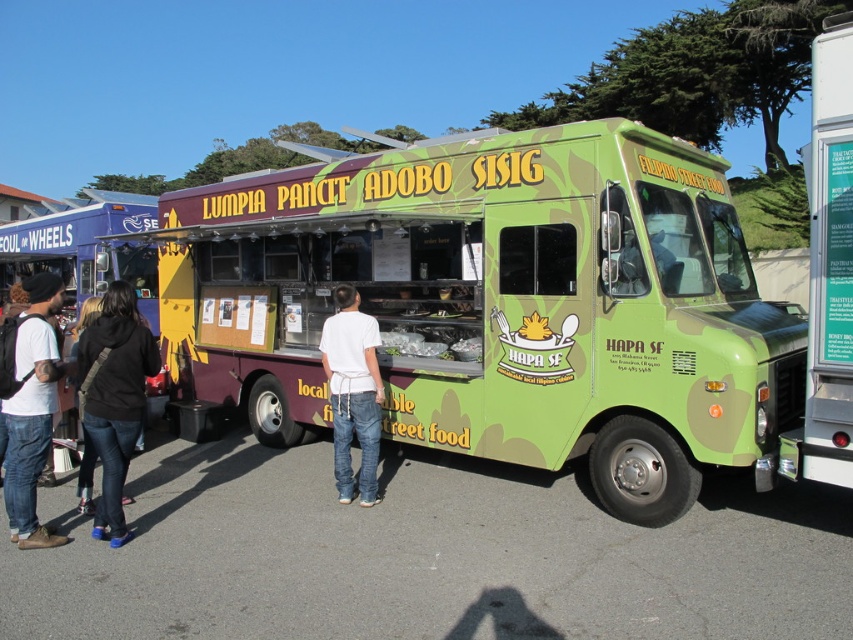
How distant is green asphalt at lower center from black denim jeans at lower left?

green asphalt at lower center and black denim jeans at lower left are 2.40 meters apart.

Is green asphalt at lower center shorter than black denim jeans at lower left?

Indeed, green asphalt at lower center has a lesser height compared to black denim jeans at lower left.

Who is more distant from viewer, (322, 524) or (103, 451)?

Positioned behind is point (322, 524).

Where is `green asphalt at lower center`? green asphalt at lower center is located at coordinates point(427,556).

Does point (293, 196) come in front of point (85, 522)?

No, it is behind (85, 522).

Describe the element at coordinates (498, 304) in the screenshot. I see `green matte food truck at center` at that location.

Find the location of `green matte food truck at center`. green matte food truck at center is located at coordinates (498, 304).

Who is higher up, green matte food truck at center or white cotton shirt at center?

white cotton shirt at center

Is green matte food truck at center bigger than white cotton shirt at center?

No.

Does point (693, 272) come in front of point (339, 316)?

That is True.

Where is `green matte food truck at center`? This screenshot has height=640, width=853. green matte food truck at center is located at coordinates (498, 304).